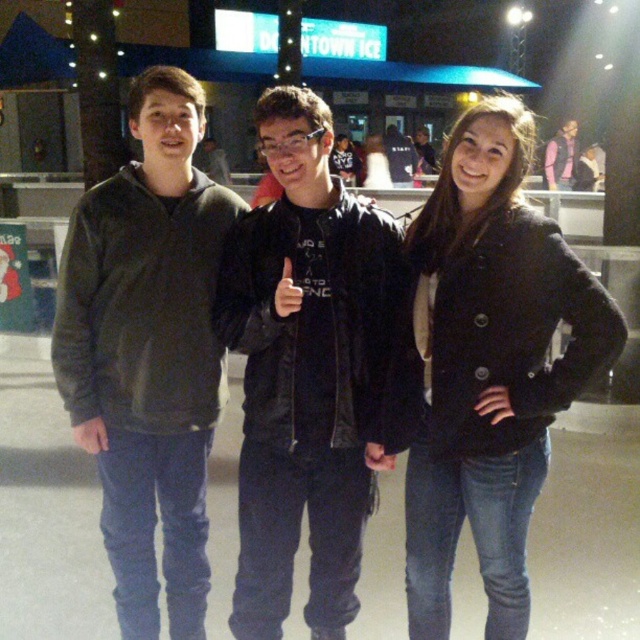
Is black fuzzy coat at center to the right of dark gray hoodie at left from the viewer's perspective?

Yes, black fuzzy coat at center is to the right of dark gray hoodie at left.

Is point (449, 205) positioned after point (202, 282)?

No, (449, 205) is closer to viewer.

Who is more distant from viewer, (550, 420) or (140, 381)?

Positioned behind is point (140, 381).

The width and height of the screenshot is (640, 640). I want to click on black fuzzy coat at center, so click(x=484, y=365).

Is dark gray hoodie at left taller than pink fabric shirt at center?

Yes, dark gray hoodie at left is taller than pink fabric shirt at center.

Which is in front, point (224, 209) or point (564, 164)?

Positioned in front is point (224, 209).

Does point (156, 122) come behind point (572, 168)?

No, (156, 122) is closer to viewer.

Image resolution: width=640 pixels, height=640 pixels. What are the coordinates of `dark gray hoodie at left` in the screenshot? It's located at (148, 352).

Does black fuzzy coat at center appear over black leather jacket at center?

No.

Measure the distance from black fuzzy coat at center to black leather jacket at center.

A distance of 13.86 inches exists between black fuzzy coat at center and black leather jacket at center.

This screenshot has width=640, height=640. Describe the element at coordinates (484, 365) in the screenshot. I see `black fuzzy coat at center` at that location.

Identify the location of black fuzzy coat at center. Image resolution: width=640 pixels, height=640 pixels. (484, 365).